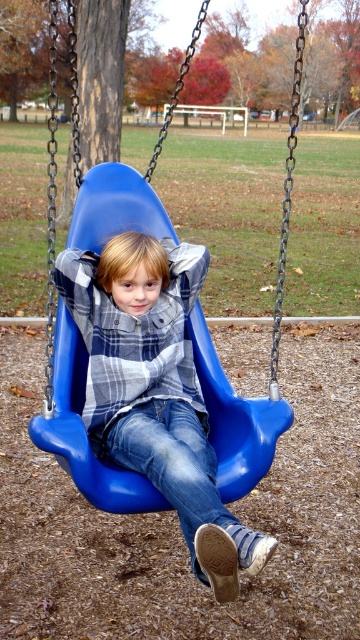
Question: Among these objects, which one is nearest to the camera?

Choices:
 (A) blue plastic swing at center
 (B) denim jeans at center

Answer: (B)

Question: Which object is closer to the camera taking this photo?

Choices:
 (A) blue plastic swing at center
 (B) plaid shirt at center

Answer: (B)

Question: Can you confirm if plaid shirt at center is positioned above blue plastic swing at center?

Choices:
 (A) no
 (B) yes

Answer: (A)

Question: Is plaid shirt at center closer to the viewer compared to blue plastic swing at center?

Choices:
 (A) yes
 (B) no

Answer: (A)

Question: Where is blue plastic swing at center located in relation to denim jeans at center in the image?

Choices:
 (A) left
 (B) right

Answer: (B)

Question: Estimate the real-world distances between objects in this image. Which object is farther from the denim jeans at center?

Choices:
 (A) blue plastic swing at center
 (B) plaid shirt at center

Answer: (A)